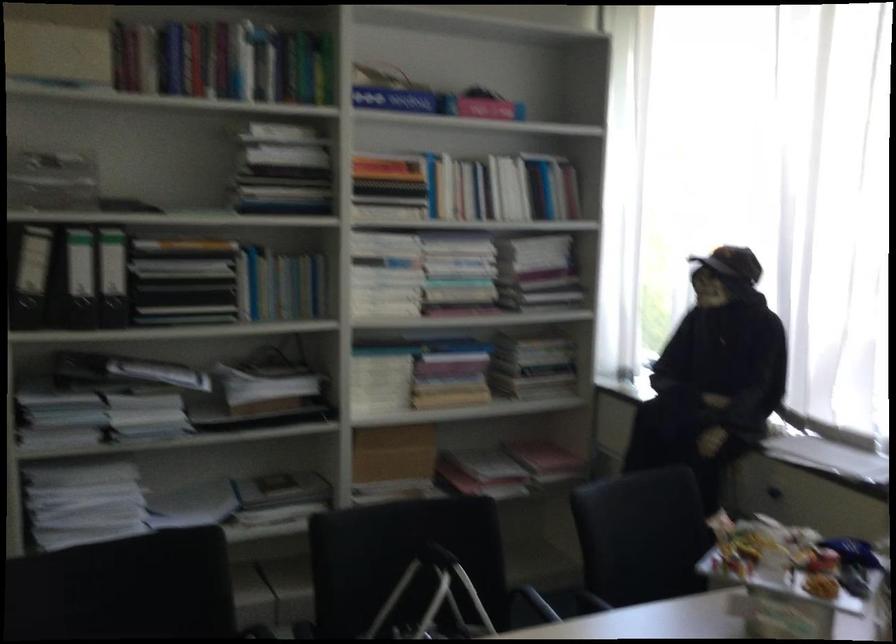
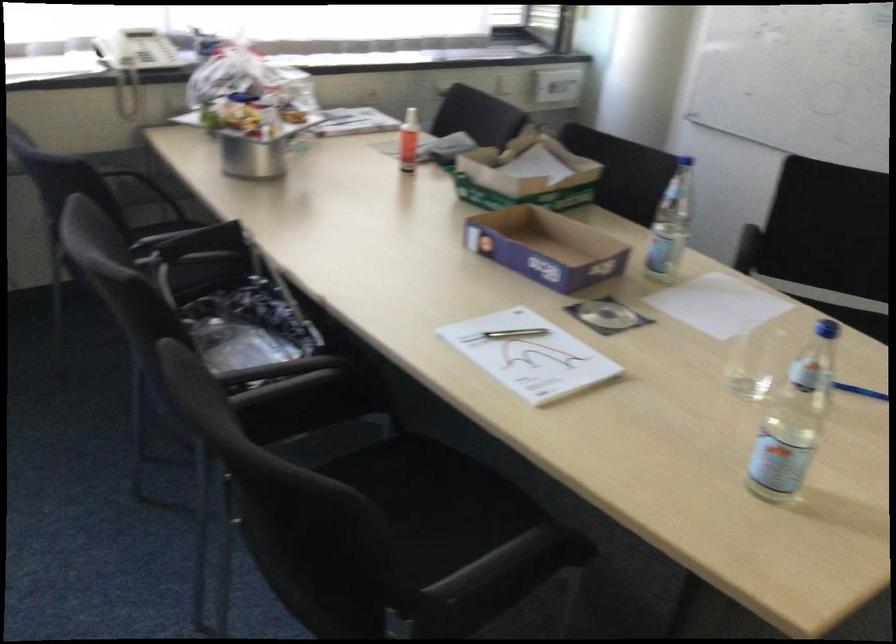
Question: I am providing you with two images of the same scene from different viewpoints. Please identify which objects are invisible in image2.

Choices:
 (A) cardboard tube roll
 (B) metal container
 (C) black chair sitting surface
 (D) black binder handle

Answer: (D)